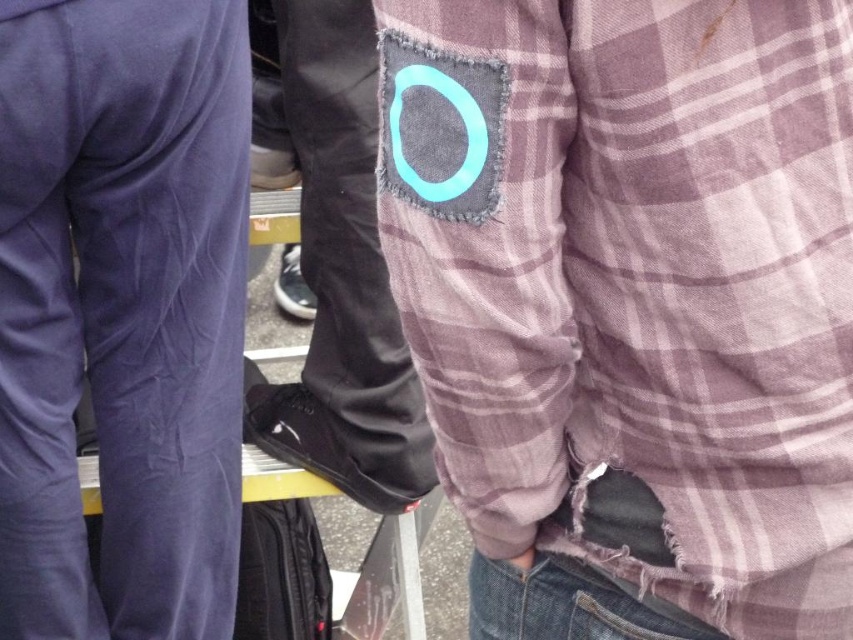
Does velvet purple pants at left have a greater width compared to denim at lower center?

Yes.

Is velvet purple pants at left taller than denim at lower center?

Indeed, velvet purple pants at left has a greater height compared to denim at lower center.

Does point (36, 250) lie behind point (577, 579)?

Yes, point (36, 250) is farther from viewer.

You are a GUI agent. You are given a task and a screenshot of the screen. Output one action in this format:
    pyautogui.click(x=<x>, y=<y>)
    Task: Click on the velvet purple pants at left
    
    Given the screenshot: What is the action you would take?
    pyautogui.click(x=120, y=310)

Between point (401, 157) and point (486, 637), which one is positioned behind?

Positioned behind is point (486, 637).

Can you confirm if plaid fabric at upper center is positioned to the left of denim at lower center?

In fact, plaid fabric at upper center is to the right of denim at lower center.

You are a GUI agent. You are given a task and a screenshot of the screen. Output one action in this format:
    pyautogui.click(x=<x>, y=<y>)
    Task: Click on the plaid fabric at upper center
    Image resolution: width=853 pixels, height=640 pixels.
    Given the screenshot: What is the action you would take?
    pyautogui.click(x=630, y=305)

Between plaid fabric at upper center and velvet purple pants at left, which one has more height?

Standing taller between the two is velvet purple pants at left.

Measure the distance between point (695, 104) and camera.

They are 58.41 centimeters apart.

I want to click on plaid fabric at upper center, so click(x=630, y=305).